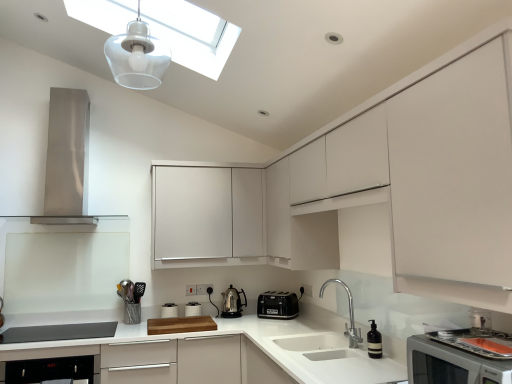
You are a GUI agent. You are given a task and a screenshot of the screen. Output one action in this format:
    pyautogui.click(x=<x>, y=<y>)
    Task: Click on the free space to the back side of polished stainless steel faucet at lower center
    This screenshot has height=384, width=512.
    Given the screenshot: What is the action you would take?
    pyautogui.click(x=330, y=334)